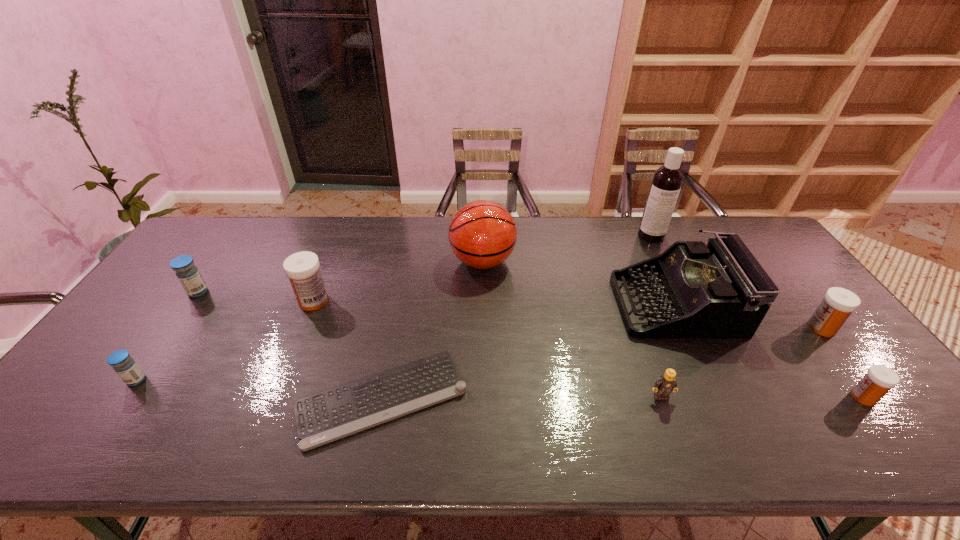
In order to click on dishwasher detergent in this screenshot , I will do `click(667, 180)`.

At what (x,y) coordinates should I click in order to perform the action: click on the ninth shortest object. Please return your answer as a coordinate pair (x, y). Looking at the image, I should click on (482, 234).

Locate an element on the screen. The image size is (960, 540). black typewriter is located at coordinates (716, 291).

Where is `the tallest medicine`? The height and width of the screenshot is (540, 960). the tallest medicine is located at coordinates (302, 268).

Locate an element on the screen. the third medicine from left to right is located at coordinates (302, 268).

Identify the location of the second biggest white medicine. Image resolution: width=960 pixels, height=540 pixels. (838, 303).

Locate an element on the screen. the third nearest medicine is located at coordinates (838, 303).

I want to click on the bigger blue medicine, so click(187, 273).

Identify the location of tan Lego. (664, 385).

Find the location of a particular element. Image resolution: width=960 pixels, height=540 pixels. the smaller blue medicine is located at coordinates (124, 365).